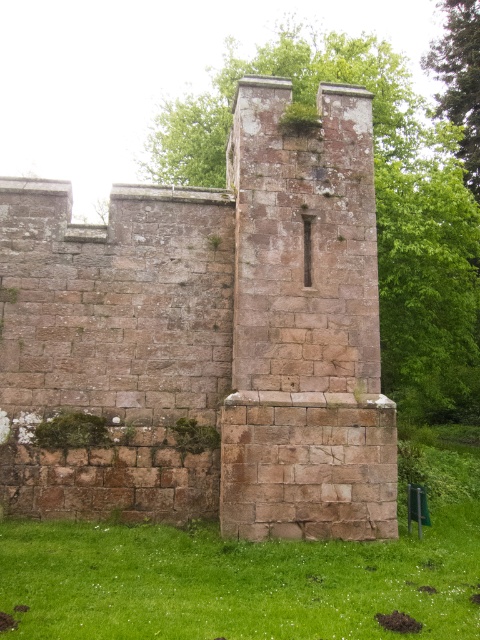
Is rustic stone tower at center wider than green grass at lower center?

Incorrect, rustic stone tower at center's width does not surpass green grass at lower center's.

Does rustic stone tower at center lie behind green grass at lower center?

Yes, it is behind green grass at lower center.

Is point (372, 332) behind point (76, 541)?

Yes, point (372, 332) is farther from viewer.

Locate an element on the screen. rustic stone tower at center is located at coordinates (210, 336).